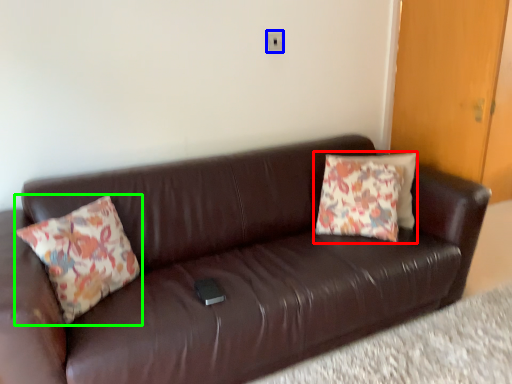
Question: Which object is positioned closest to pillow (highlighted by a red box)? Select from electric outlet (highlighted by a blue box) and pillow (highlighted by a green box).

Choices:
 (A) electric outlet
 (B) pillow

Answer: (A)